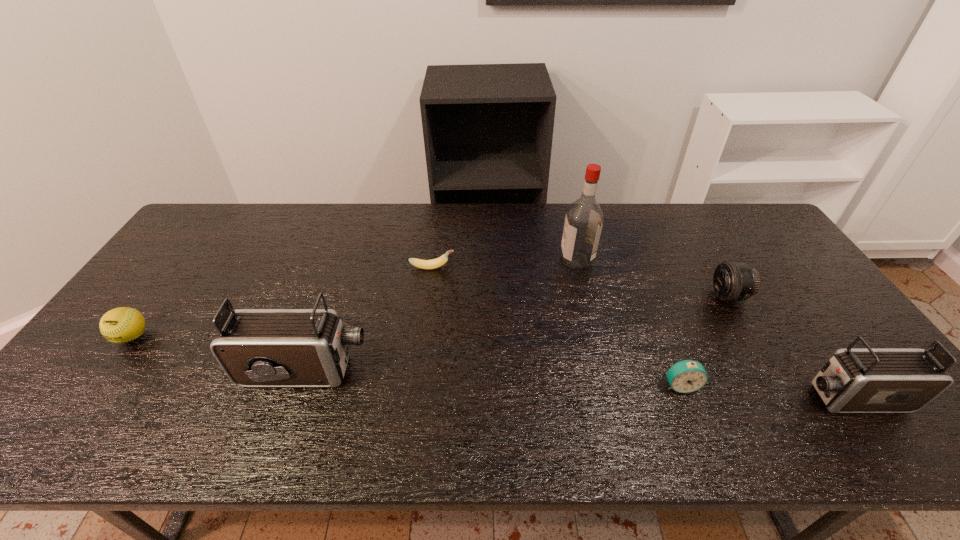
Please point a space for a new camcorder to maintain equal intervals. Please provide its 2D coordinates. Your answer should be formatted as a tuple, i.e. [(x, y)], where the tuple contains the x and y coordinates of a point satisfying the conditions above.

[(571, 384)]